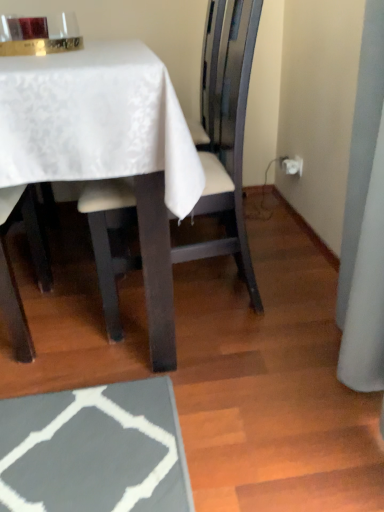
Question: Is white leather chair at center wider or thinner than white satin table at upper left?

Choices:
 (A) thin
 (B) wide

Answer: (A)

Question: From the image's perspective, relative to white satin table at upper left, is white leather chair at center above or below?

Choices:
 (A) above
 (B) below

Answer: (B)

Question: Considering the relative positions of white leather chair at center and white satin table at upper left in the image provided, is white leather chair at center to the left or to the right of white satin table at upper left?

Choices:
 (A) right
 (B) left

Answer: (A)

Question: Considering the positions of point click(152, 74) and point click(231, 92), is point click(152, 74) closer or farther from the camera than point click(231, 92)?

Choices:
 (A) closer
 (B) farther

Answer: (A)

Question: Considering the positions of white satin table at upper left and white leather chair at center in the image, is white satin table at upper left taller or shorter than white leather chair at center?

Choices:
 (A) tall
 (B) short

Answer: (B)

Question: Is white satin table at upper left situated inside white leather chair at center or outside?

Choices:
 (A) inside
 (B) outside

Answer: (B)

Question: Considering the positions of white satin table at upper left and white leather chair at center in the image, is white satin table at upper left bigger or smaller than white leather chair at center?

Choices:
 (A) big
 (B) small

Answer: (A)